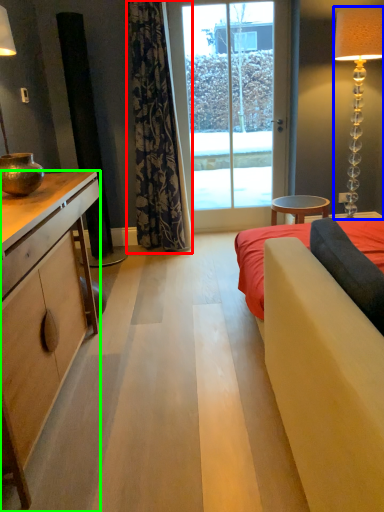
Question: Considering the real-world distances, which object is farthest from curtain (highlighted by a red box)? lamp (highlighted by a blue box) or cabinetry (highlighted by a green box)?

Choices:
 (A) lamp
 (B) cabinetry

Answer: (A)